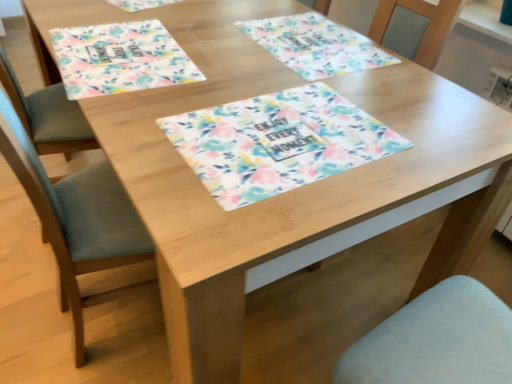
Question: Considering the relative sizes of floral fabric placemat at upper left, the first place mat in the left-to-right sequence, and floral fabric placemat at center, the first place mat when ordered from right to left, in the image provided, is floral fabric placemat at upper left, the first place mat in the left-to-right sequence, thinner than floral fabric placemat at center, the first place mat when ordered from right to left,?

Choices:
 (A) no
 (B) yes

Answer: (A)

Question: Is floral fabric placemat at center, positioned as the second place mat in left-to-right order, completely or partially inside floral fabric placemat at upper left, the first place mat in the left-to-right sequence?

Choices:
 (A) yes
 (B) no

Answer: (B)

Question: Does floral fabric placemat at upper left, the first place mat in the left-to-right sequence, have a greater height compared to floral fabric placemat at center, the first place mat when ordered from right to left?

Choices:
 (A) no
 (B) yes

Answer: (B)

Question: From a real-world perspective, is floral fabric placemat at upper left, placed as the second place mat when sorted from right to left, under floral fabric placemat at center, the first place mat when ordered from right to left?

Choices:
 (A) no
 (B) yes

Answer: (B)

Question: Is floral fabric placemat at upper left, placed as the second place mat when sorted from right to left, next to floral fabric placemat at center, the first place mat when ordered from right to left?

Choices:
 (A) yes
 (B) no

Answer: (B)

Question: Can you confirm if floral fabric placemat at upper left, the first place mat in the left-to-right sequence, is shorter than floral fabric placemat at center, the first place mat when ordered from right to left?

Choices:
 (A) no
 (B) yes

Answer: (A)

Question: Is floral fabric placemat at center not within floral fabric placemat at upper left, the first place mat in the left-to-right sequence?

Choices:
 (A) no
 (B) yes

Answer: (B)

Question: Is floral fabric placemat at center positioned with its back to floral fabric placemat at upper left, placed as the second place mat when sorted from right to left?

Choices:
 (A) no
 (B) yes

Answer: (A)

Question: Could you tell me if floral fabric placemat at center is facing floral fabric placemat at upper left, the first place mat in the left-to-right sequence?

Choices:
 (A) no
 (B) yes

Answer: (A)

Question: Does floral fabric placemat at center have a lesser width compared to floral fabric placemat at upper left, placed as the second place mat when sorted from right to left?

Choices:
 (A) no
 (B) yes

Answer: (A)

Question: Is floral fabric placemat at center placed right next to floral fabric placemat at upper left, placed as the second place mat when sorted from right to left?

Choices:
 (A) yes
 (B) no

Answer: (B)

Question: Is floral fabric placemat at center positioned in front of floral fabric placemat at upper left, placed as the second place mat when sorted from right to left?

Choices:
 (A) no
 (B) yes

Answer: (B)

Question: Is the depth of floral fabric placemat at upper left, the first place mat in the left-to-right sequence, greater than that of floral fabric placemat at center?

Choices:
 (A) no
 (B) yes

Answer: (B)